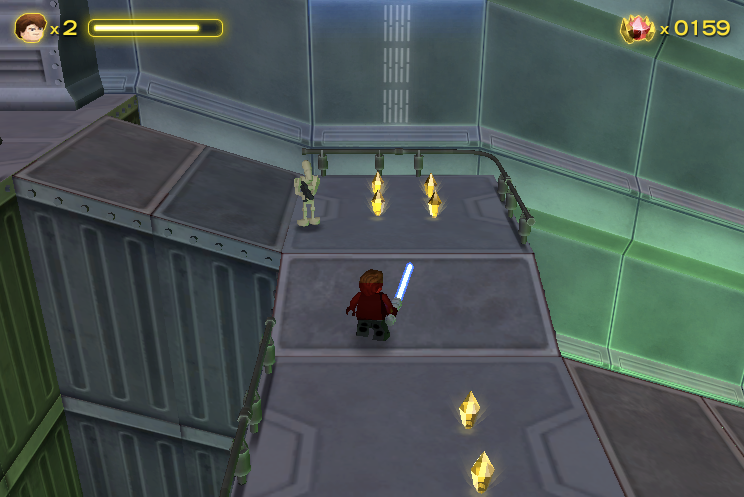
Find the location of `main corridor walls`. main corridor walls is located at coordinates (266, 64), (407, 77), (535, 98), (715, 153).